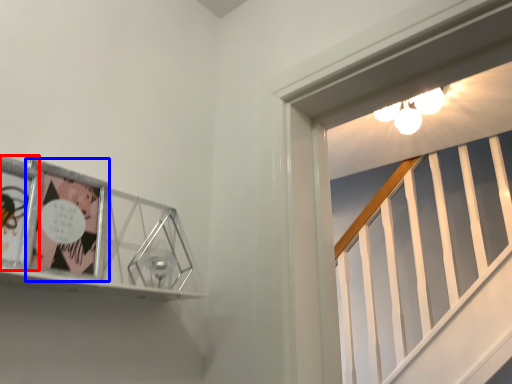
Question: Which point is closer to the camera, comic book (highlighted by a red box) or comic book (highlighted by a blue box)?

Choices:
 (A) comic book
 (B) comic book

Answer: (A)